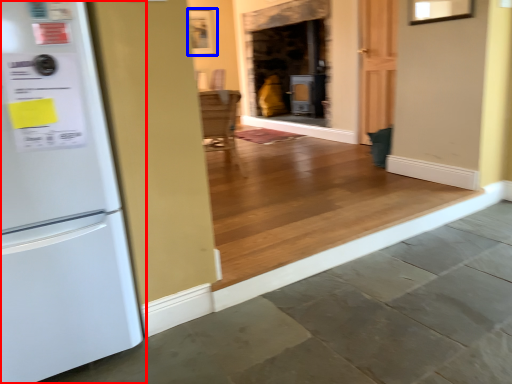
Question: Which object appears farthest to the camera in this image, refrigerator (highlighted by a red box) or picture frame (highlighted by a blue box)?

Choices:
 (A) refrigerator
 (B) picture frame

Answer: (B)